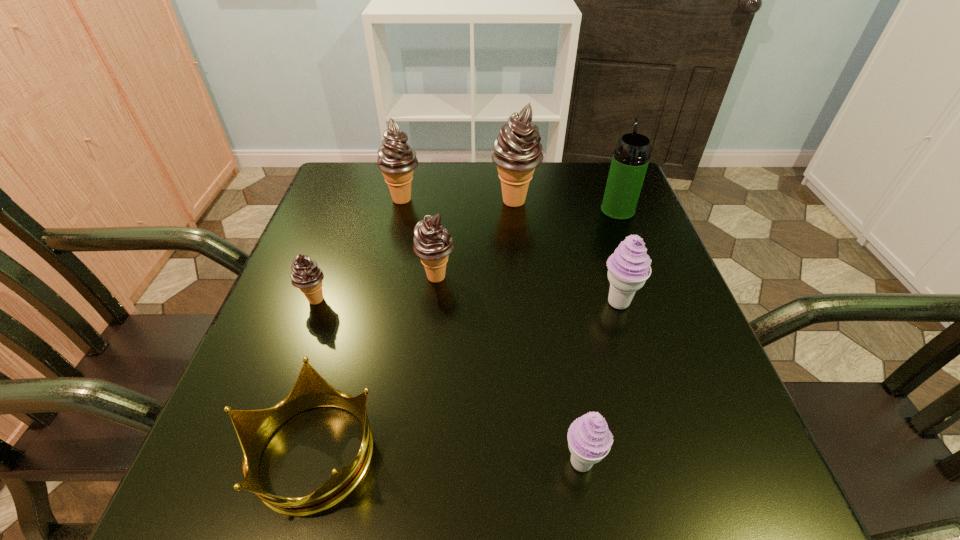
Where is `icecream present at the right edge`? The image size is (960, 540). icecream present at the right edge is located at coordinates (629, 267).

Where is `object present at the far left corner`? Image resolution: width=960 pixels, height=540 pixels. object present at the far left corner is located at coordinates (396, 159).

Where is `object positioned at the near left corner`? This screenshot has height=540, width=960. object positioned at the near left corner is located at coordinates point(254,428).

You are a GUI agent. You are given a task and a screenshot of the screen. Output one action in this format:
    pyautogui.click(x=<x>, y=<y>)
    Task: Click on the object located in the far right corner section of the desktop
    
    Given the screenshot: What is the action you would take?
    pyautogui.click(x=630, y=160)

At what (x,y) coordinates should I click in order to perform the action: click on vacant space at the far edge. Please return your answer as a coordinate pair (x, y). This screenshot has width=960, height=540. Looking at the image, I should click on (523, 210).

Identify the location of vacant space at the left edge of the desktop. The width and height of the screenshot is (960, 540). (255, 363).

Locate an element on the screen. This screenshot has width=960, height=540. vacant space at the right edge of the desktop is located at coordinates (599, 239).

Locate an element on the screen. free location at the far left corner of the desktop is located at coordinates (339, 168).

The width and height of the screenshot is (960, 540). I want to click on free location at the far right corner, so click(x=598, y=183).

This screenshot has width=960, height=540. What are the coordinates of `free space between the rightmost icecream and the third chocolate icecream from right to left` in the screenshot? It's located at (510, 251).